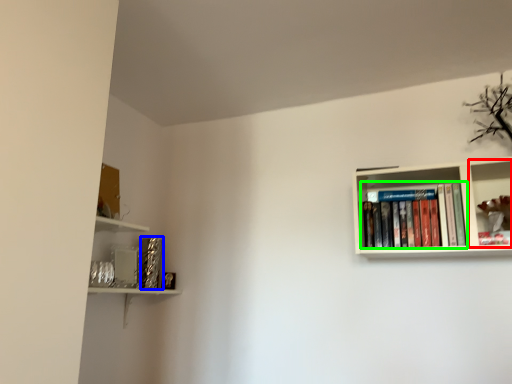
Question: Considering the real-world distances, which object is farthest from shelf (highlighted by a red box)? paperback book (highlighted by a blue box) or book (highlighted by a green box)?

Choices:
 (A) paperback book
 (B) book

Answer: (A)